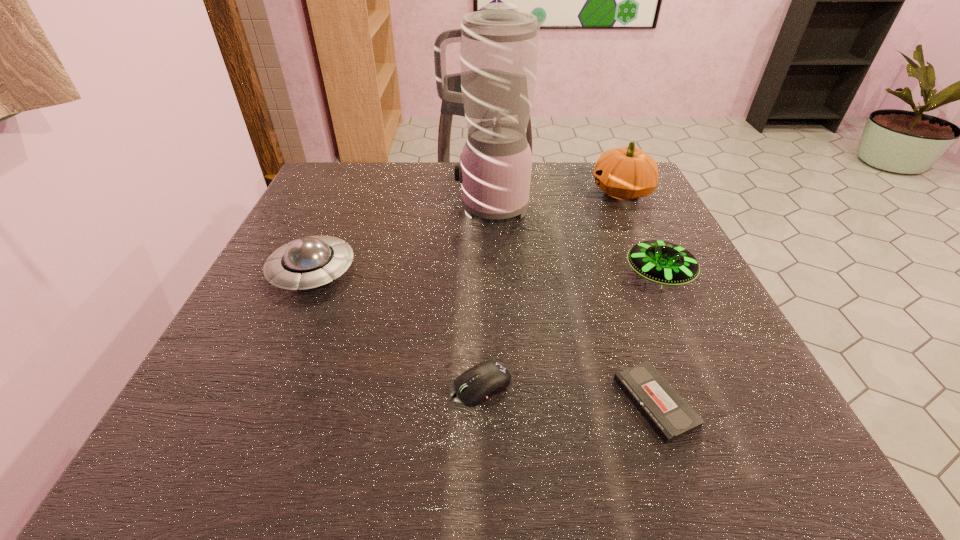
The image size is (960, 540). I want to click on food processor, so click(499, 45).

Locate an element on the screen. The height and width of the screenshot is (540, 960). the second tallest object is located at coordinates (625, 173).

The image size is (960, 540). I want to click on the left saucer, so click(x=309, y=262).

Locate an element on the screen. the right saucer is located at coordinates (665, 263).

Locate an element on the screen. The image size is (960, 540). the fifth tallest object is located at coordinates (475, 385).

The width and height of the screenshot is (960, 540). In order to click on the shortest object in this screenshot , I will do `click(669, 414)`.

Where is `vacant space situated 0.140m on the base of the food processor near the control knob`? The width and height of the screenshot is (960, 540). vacant space situated 0.140m on the base of the food processor near the control knob is located at coordinates (383, 207).

Where is `vacant space situated 0.220m on the base of the food processor near the control knob`? vacant space situated 0.220m on the base of the food processor near the control knob is located at coordinates (348, 207).

At what (x,y) coordinates should I click in order to perform the action: click on blank area located on the base of the food processor near the control knob. Please return your answer as a coordinate pair (x, y). This screenshot has width=960, height=540. Looking at the image, I should click on (305, 207).

The image size is (960, 540). In order to click on vacant area situated on the side of the fifth shortest object with the carved face in this screenshot , I will do `click(561, 191)`.